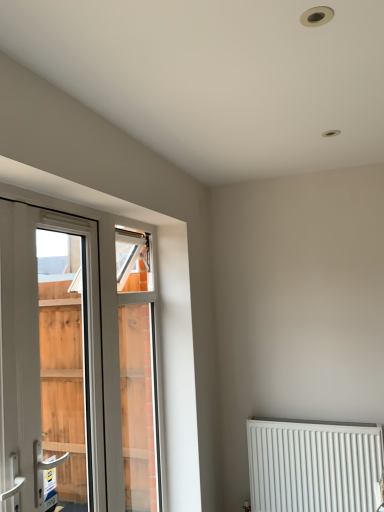
Question: Considering the positions of white plastic window at left and white metal radiator at lower right in the image, is white plastic window at left wider or thinner than white metal radiator at lower right?

Choices:
 (A) wide
 (B) thin

Answer: (B)

Question: Would you say white plastic window at left is inside or outside white metal radiator at lower right?

Choices:
 (A) inside
 (B) outside

Answer: (B)

Question: Considering their positions, is white plastic window at left located in front of or behind white metal radiator at lower right?

Choices:
 (A) behind
 (B) front

Answer: (B)

Question: Do you think white metal radiator at lower right is within white plastic window at left, or outside of it?

Choices:
 (A) inside
 (B) outside

Answer: (B)

Question: From a real-world perspective, is white metal radiator at lower right above or below white plastic window at left?

Choices:
 (A) above
 (B) below

Answer: (B)

Question: Is white metal radiator at lower right to the left or to the right of white plastic window at left in the image?

Choices:
 (A) right
 (B) left

Answer: (A)

Question: Is point (254, 506) positioned closer to the camera than point (74, 318)?

Choices:
 (A) closer
 (B) farther

Answer: (A)